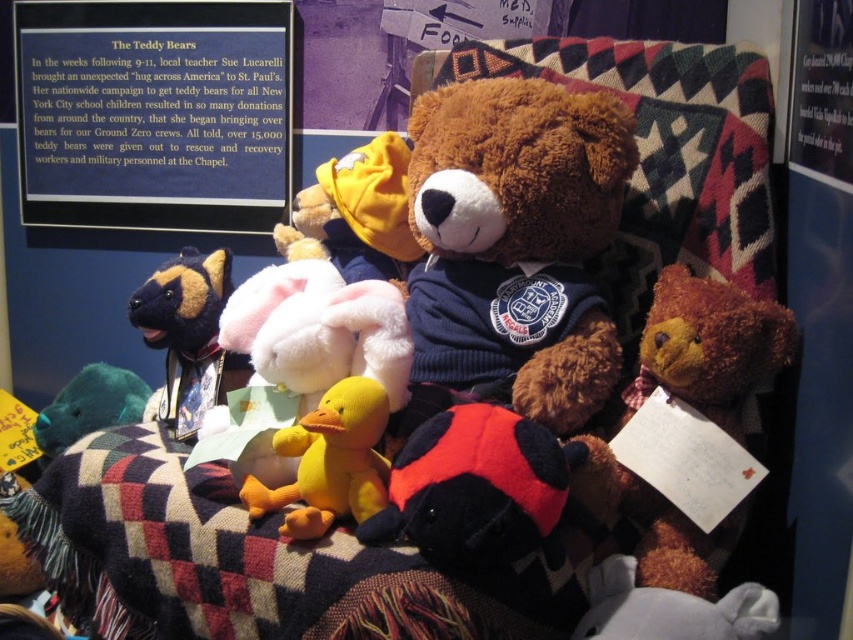
The image size is (853, 640). What are the coordinates of `soft brown teddy bear at center` in the screenshot? It's located at (514, 246).

Is soft brown teddy bear at center further to the viewer compared to checkerboard wool blanket at center?

Yes, it is.

Locate an element on the screen. The height and width of the screenshot is (640, 853). soft brown teddy bear at center is located at coordinates (514, 246).

Is checkerboard wool blanket at center taller than yellow plush duck at center?

Yes.

Where is `checkerboard wool blanket at center`? checkerboard wool blanket at center is located at coordinates (218, 554).

Can you confirm if soft brown teddy bear at center is positioned to the left of blue/metallic signboard at upper left?

No, soft brown teddy bear at center is not to the left of blue/metallic signboard at upper left.

Can you confirm if soft brown teddy bear at center is taller than blue/metallic signboard at upper left?

Correct, soft brown teddy bear at center is much taller as blue/metallic signboard at upper left.

Which is in front, point (399, 417) or point (146, 212)?

Point (399, 417) is more forward.

Find the location of a particular element. This screenshot has height=640, width=853. soft brown teddy bear at center is located at coordinates (514, 246).